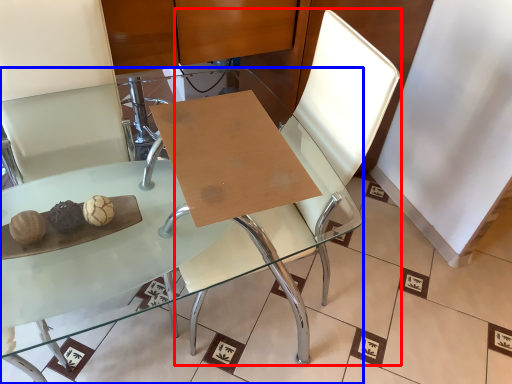
Question: Which object is further to the camera taking this photo, swivel chair (highlighted by a red box) or table (highlighted by a blue box)?

Choices:
 (A) swivel chair
 (B) table

Answer: (A)